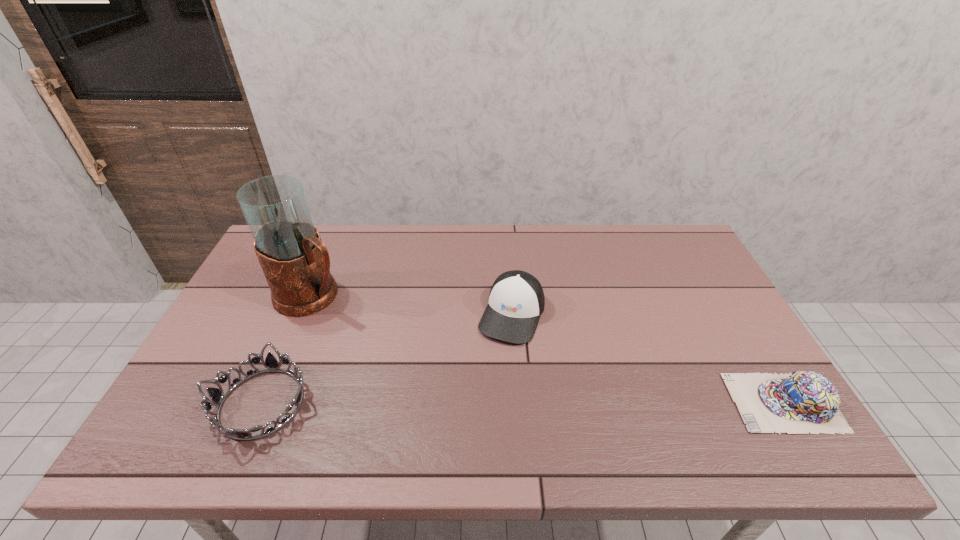
I want to click on vacant area that lies between the taller cap and the tallest object, so click(412, 305).

Image resolution: width=960 pixels, height=540 pixels. In order to click on free spot between the nearer cap and the farther cap in this screenshot , I will do `click(648, 359)`.

I want to click on blank region between the nearer cap and the tallest object, so click(548, 349).

I want to click on unoccupied position between the pitcher and the shorter cap, so click(548, 349).

I want to click on vacant area that lies between the tiara and the left cap, so click(x=387, y=359).

The width and height of the screenshot is (960, 540). In order to click on free spot between the tiara and the tallest object in this screenshot , I will do `click(287, 349)`.

Identify the location of object that is the nearest to the nearer cap. (516, 300).

Point out which object is positioned as the second nearest to the tiara. Please provide its 2D coordinates. Your answer should be formatted as a tuple, i.e. [(x, y)], where the tuple contains the x and y coordinates of a point satisfying the conditions above.

[(516, 300)]

The height and width of the screenshot is (540, 960). I want to click on vacant space that satisfies the following two spatial constraints: 1. on the front side of the second object from right to left; 2. on the front, side, and top of the nearer cap, so click(518, 402).

Locate an element on the screen. The height and width of the screenshot is (540, 960). free spot that satisfies the following two spatial constraints: 1. on the front side of the left cap; 2. on the front, side, and top of the nearer cap is located at coordinates (518, 402).